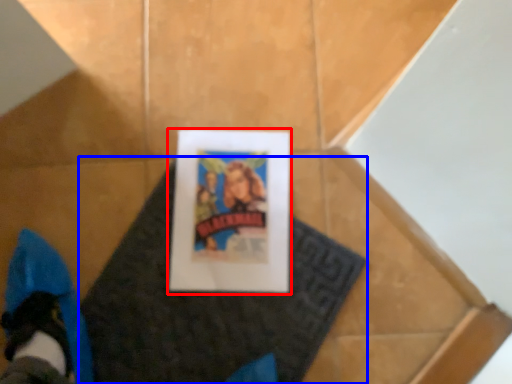
Question: Which object is closer to the camera taking this photo, picture frame (highlighted by a red box) or blanket (highlighted by a blue box)?

Choices:
 (A) picture frame
 (B) blanket

Answer: (B)